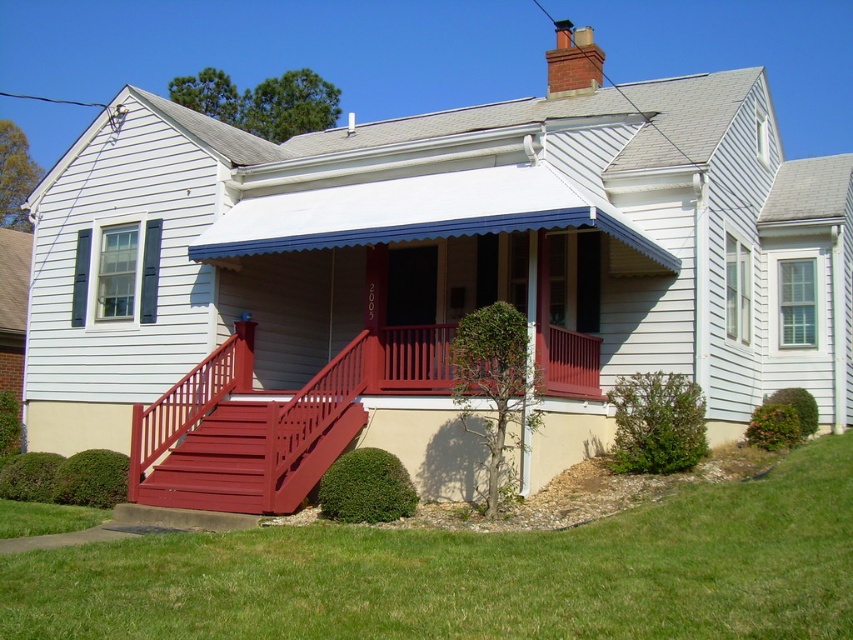
Question: Which is farther from the green grass at lower center?

Choices:
 (A) smooth wood stairs at center
 (B) smooth red wooden porch at center

Answer: (B)

Question: Does smooth red wooden porch at center appear on the right side of smooth wood stairs at center?

Choices:
 (A) yes
 (B) no

Answer: (B)

Question: Among these objects, which one is nearest to the camera?

Choices:
 (A) smooth red wooden porch at center
 (B) green grass at lower center

Answer: (B)

Question: Does green grass at lower center have a greater width compared to smooth red wooden porch at center?

Choices:
 (A) no
 (B) yes

Answer: (B)

Question: Which object is closer to the camera taking this photo?

Choices:
 (A) green grass at lower center
 (B) smooth red wooden porch at center

Answer: (A)

Question: Is smooth red wooden porch at center wider than smooth wood stairs at center?

Choices:
 (A) no
 (B) yes

Answer: (A)